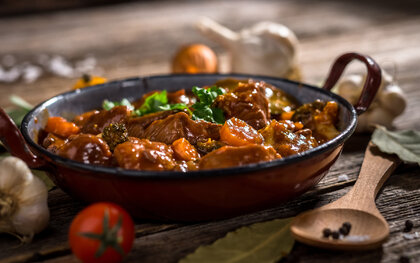
You are a GUI agent. You are given a task and a screenshot of the screen. Output one action in this format:
    pyautogui.click(x=<x>, y=<y>)
    Task: Click on the skillet handle on right
    This screenshot has width=420, height=263.
    Given the screenshot: What is the action you would take?
    pyautogui.click(x=375, y=67)